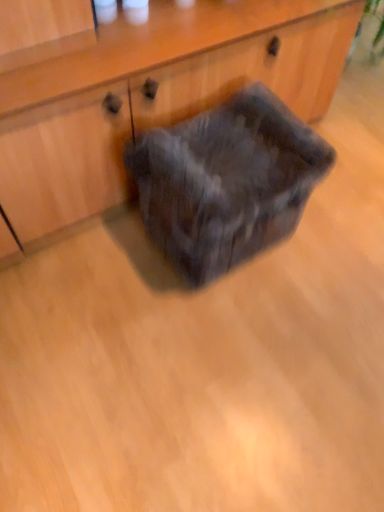
Where is `vacant space in front of textured gray fabric chair at center`? vacant space in front of textured gray fabric chair at center is located at coordinates (215, 337).